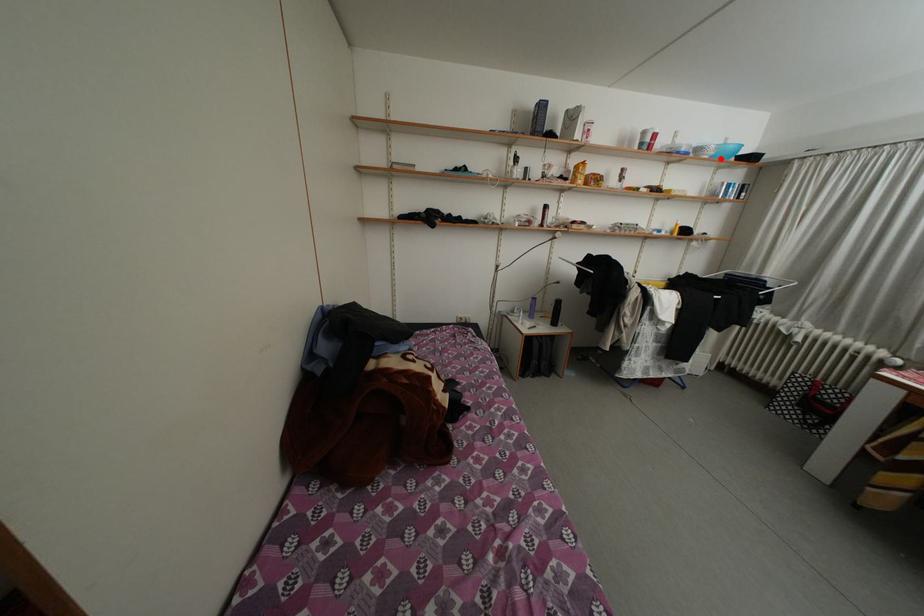
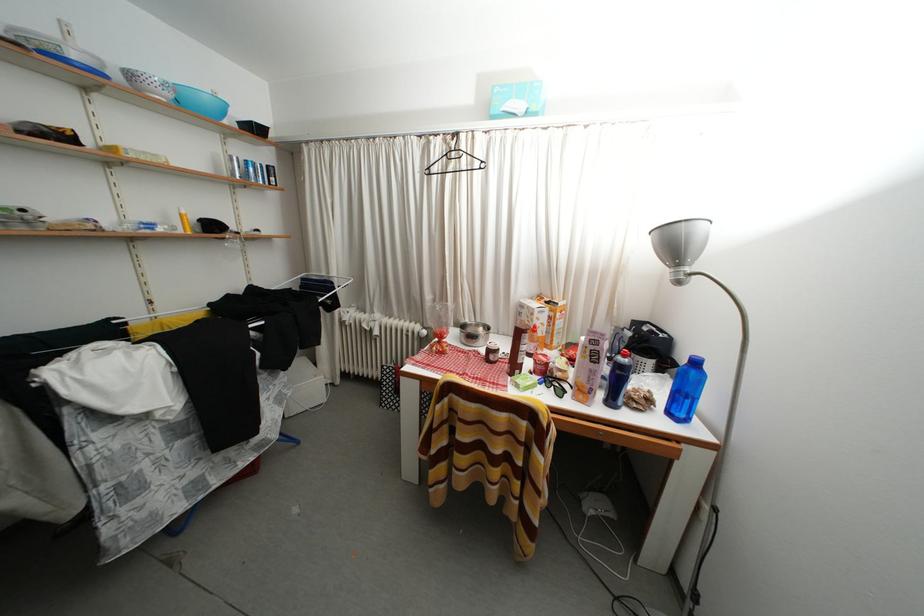
The point at the highlighted location is marked in the first image. Where is the corresponding point in the second image?

(178, 100)